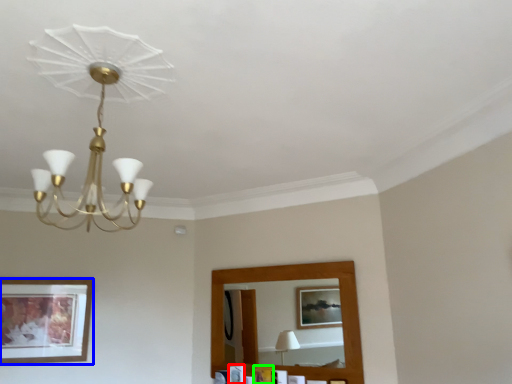
Question: Which is farther away from picture frame (highlighted by a red box)? picture frame (highlighted by a blue box) or picture frame (highlighted by a green box)?

Choices:
 (A) picture frame
 (B) picture frame

Answer: (A)